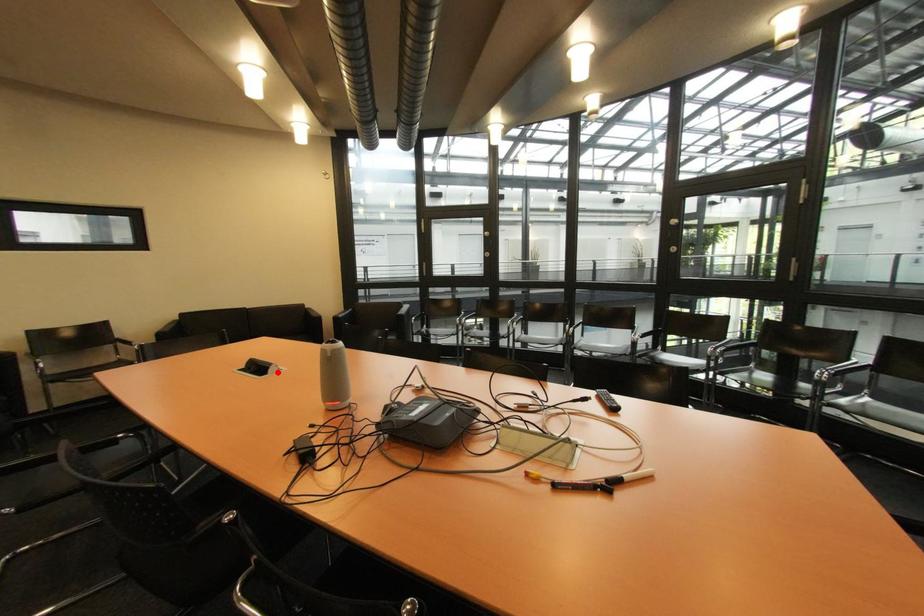
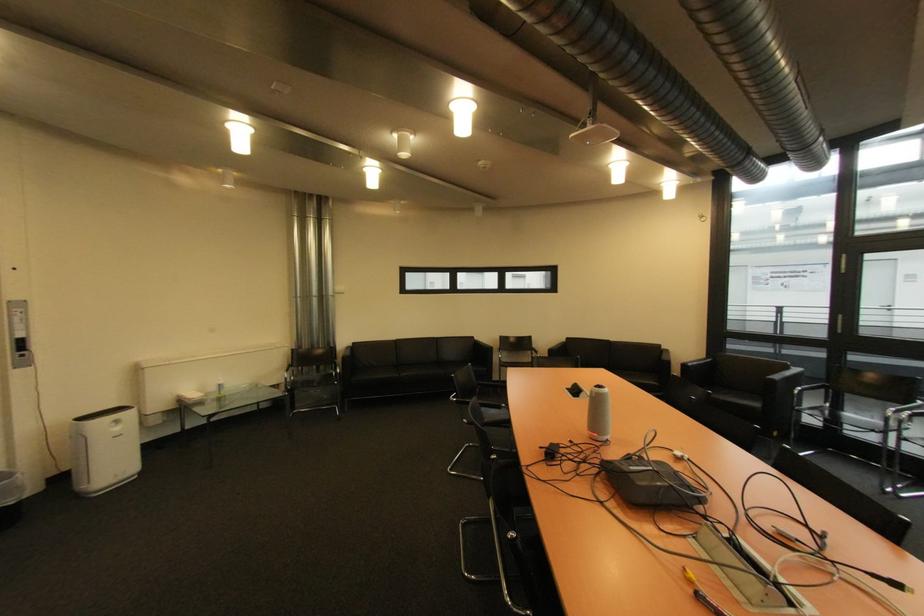
Where in the second image is the point corresponding to the highlighted location from the first image?

(590, 397)